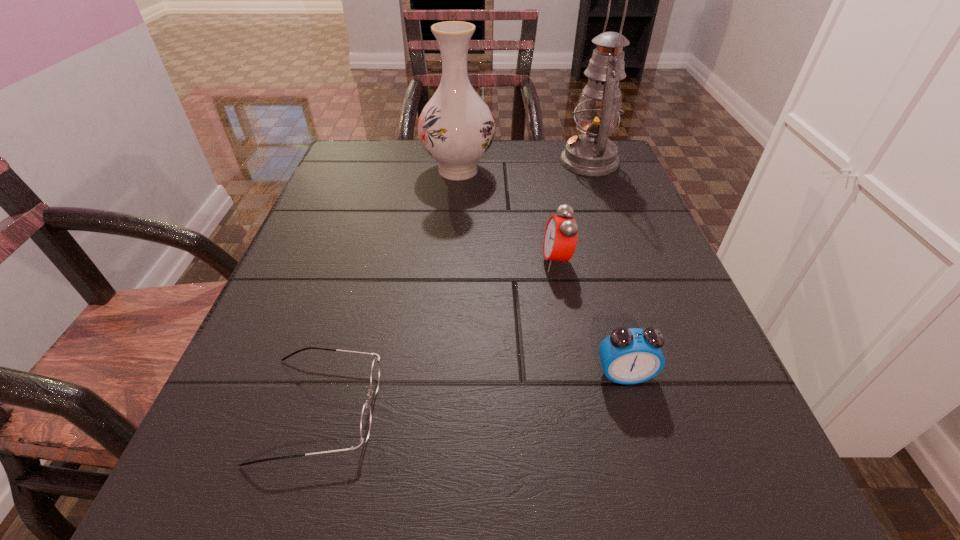
You are a GUI agent. You are given a task and a screenshot of the screen. Output one action in this format:
    pyautogui.click(x=<x>, y=<y>)
    Task: Click on the object located in the far right corner section of the desktop
    This screenshot has width=960, height=540.
    Given the screenshot: What is the action you would take?
    pyautogui.click(x=592, y=153)

At what (x,y) coordinates should I click in order to perform the action: click on free space at the left edge of the desktop. Please return your answer as a coordinate pair (x, y). The height and width of the screenshot is (540, 960). Looking at the image, I should click on (267, 464).

You are a GUI agent. You are given a task and a screenshot of the screen. Output one action in this format:
    pyautogui.click(x=<x>, y=<y>)
    Task: Click on the vacant region at the right edge of the desktop
    The width and height of the screenshot is (960, 540).
    Given the screenshot: What is the action you would take?
    pyautogui.click(x=637, y=209)

In the image, there is a desktop. What are the coordinates of `vacant space at the far left corner` in the screenshot? It's located at coord(365,146).

This screenshot has height=540, width=960. I want to click on blank space at the near left corner, so click(289, 481).

At what (x,y) coordinates should I click in order to perform the action: click on vacant region at the far right corner of the desktop. Please return your answer as a coordinate pair (x, y). The height and width of the screenshot is (540, 960). Looking at the image, I should click on (559, 171).

This screenshot has width=960, height=540. In the image, there is a desktop. In order to click on vacant space at the near right corner in this screenshot , I will do coord(660,476).

This screenshot has height=540, width=960. I want to click on free point between the second shortest object and the farther alarm clock, so click(590, 318).

This screenshot has width=960, height=540. Identify the location of empty space that is in between the spectacles and the oil lamp. (455, 285).

I want to click on vacant point located between the third nearest object and the nearer alarm clock, so [590, 318].